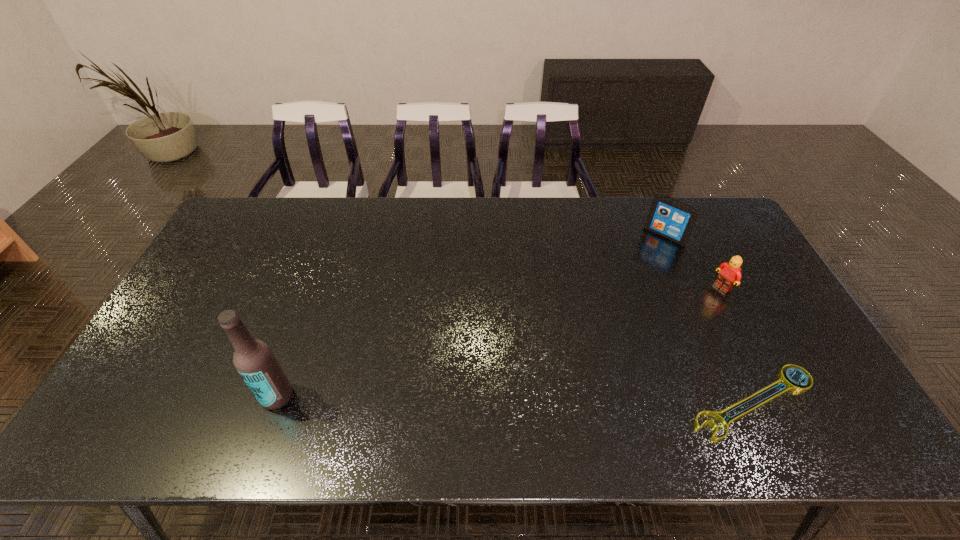
Locate an element on the screen. empty space between the shortest object and the farthest object is located at coordinates (x=709, y=319).

The height and width of the screenshot is (540, 960). I want to click on empty space that is in between the Lego and the farthest object, so click(x=693, y=261).

Identify the location of free point between the shortest object and the iPod. (709, 319).

Where is `free spot between the beer bottle and the Lego`? This screenshot has width=960, height=540. free spot between the beer bottle and the Lego is located at coordinates (499, 342).

Find the location of a particular element. The image size is (960, 540). vacant region between the wrench and the iPod is located at coordinates (709, 319).

Identify the location of vacant space that is in between the beer bottle and the second farthest object. The width and height of the screenshot is (960, 540). (499, 342).

Find the location of `the second closest object to the Lego`. the second closest object to the Lego is located at coordinates (x=792, y=385).

This screenshot has width=960, height=540. I want to click on object that stands as the closest to the wrench, so click(x=730, y=274).